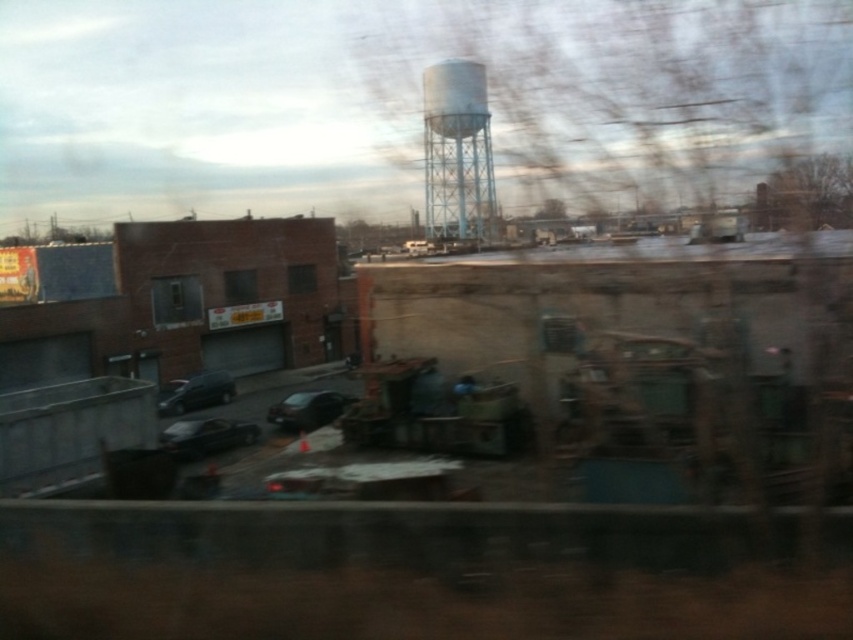
You are a passenger in a moving vehicle and see the shiny black car at lower left and the metallic gray train window at center. Which object appears taller in the image?

The metallic gray train window at center appears taller than the shiny black car at lower left.

Consider the image. You are a drone operator who needs to land a drone on the point marked at coordinates (445, 195) in the image. The drone has a maximum flight range of 10 meters. Based on the scene description, can the drone safely land on that point?

The point marked at coordinates (445, 195) is 9.34 meters away from the viewer, which is within the drone operator drone has a maximum flight range of 10 meters. Therefore, the drone can safely land on that point.

You are a photographer trying to capture the white textured water tower at center from inside a moving vehicle. Given that the vehicle window is at the bottom edge of your view, can you estimate whether the water tower will be fully visible in your photo?

The white textured water tower at center is positioned at coordinates point (457,152), which is above the lower part of the frame where the barrier is located. Since the vehicle window is at the bottom edge, the water tower should be fully visible in the photo as it is centrally placed and not obstructed by the barrier.